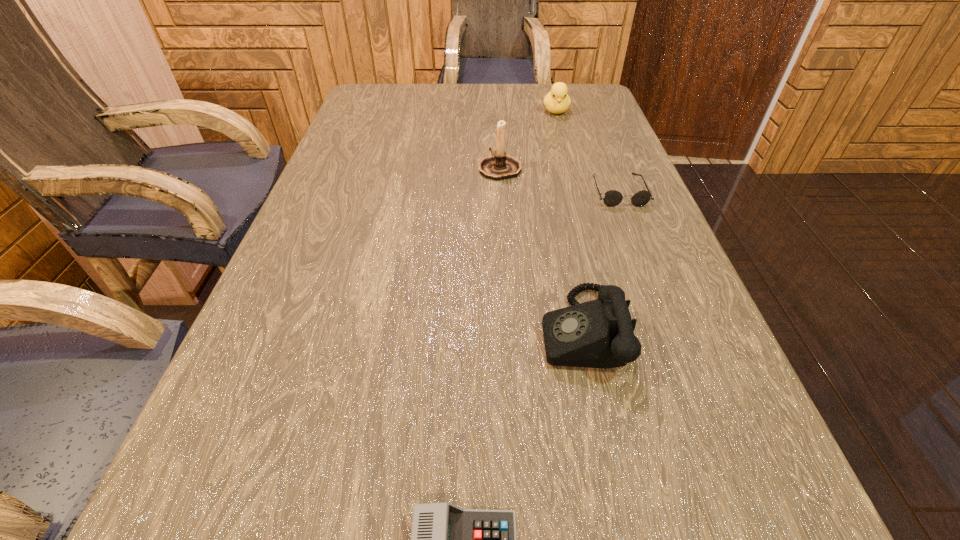
The width and height of the screenshot is (960, 540). Identify the location of the tallest object. [500, 166].

Locate an element on the screen. the farthest object is located at coordinates (557, 101).

This screenshot has width=960, height=540. I want to click on the fourth farthest object, so click(600, 333).

Where is `the fourth tallest object`? This screenshot has width=960, height=540. the fourth tallest object is located at coordinates (612, 198).

Locate an element on the screen. The image size is (960, 540). free space located on the right of the tallest object is located at coordinates (542, 168).

Find the location of a particular element. This screenshot has width=960, height=540. vacant space located on the front-facing side of the duck is located at coordinates (576, 183).

At what (x,y) coordinates should I click in order to perform the action: click on free space located on the dial of the telephone. Please return your answer as a coordinate pair (x, y). Looking at the image, I should click on (394, 330).

At what (x,y) coordinates should I click in order to perform the action: click on vacant space located on the dial of the telephone. Please return your answer as a coordinate pair (x, y). Looking at the image, I should click on (332, 330).

Find the location of `vacant area situated on the dial of the telephone`. vacant area situated on the dial of the telephone is located at coordinates (339, 330).

In order to click on free region located on the front-facing side of the second shortest object in this screenshot , I will do `click(658, 292)`.